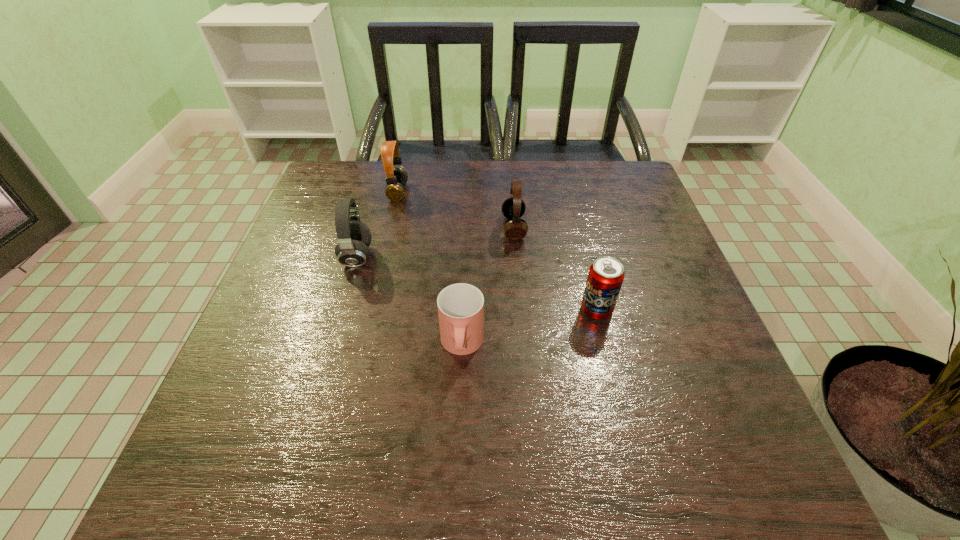
Identify the location of the farthest headset. (396, 178).

Identify the location of the second object from right to left. (513, 208).

Where is `the rightmost object`? The width and height of the screenshot is (960, 540). the rightmost object is located at coordinates (606, 275).

This screenshot has height=540, width=960. Identify the location of the shortest object. pos(460,306).

At what (x,y) coordinates should I click in order to perform the action: click on the third object from right to left. Please return your answer as a coordinate pair (x, y). Looking at the image, I should click on [x=460, y=306].

Where is `blank space located on the ear cups of the farthest headset`? This screenshot has height=540, width=960. blank space located on the ear cups of the farthest headset is located at coordinates (503, 192).

At what (x,y) coordinates should I click in order to perform the action: click on free space located 0.350m on the ear pads of the second object from right to left. Please return your answer as a coordinate pair (x, y). The image size is (960, 540). Looking at the image, I should click on (365, 228).

Identify the location of vacant space located 0.110m on the ear pads of the second object from right to left. The height and width of the screenshot is (540, 960). (459, 228).

The image size is (960, 540). In order to click on vacant space located 0.360m on the ear pads of the second object from right to left in this screenshot , I will do `click(361, 228)`.

What are the coordinates of `vacant space situated on the back of the soda can` in the screenshot? It's located at (586, 267).